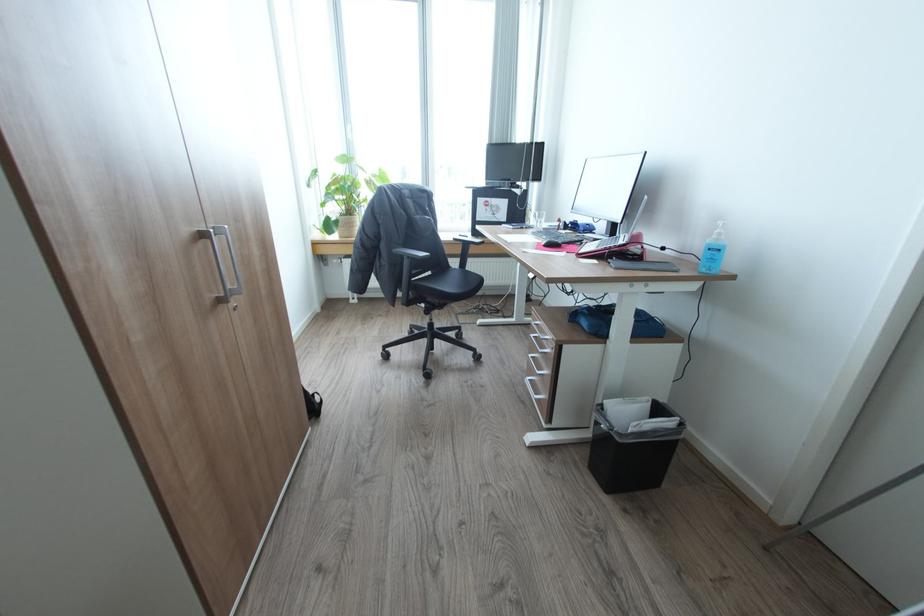
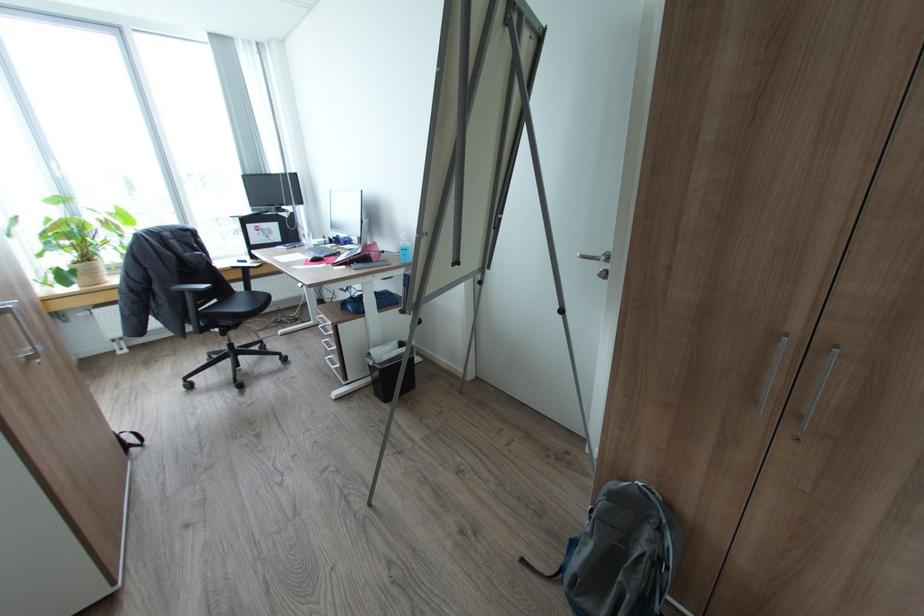
Find the pixel in the second image that matches point (412, 257) in the first image.

(195, 292)